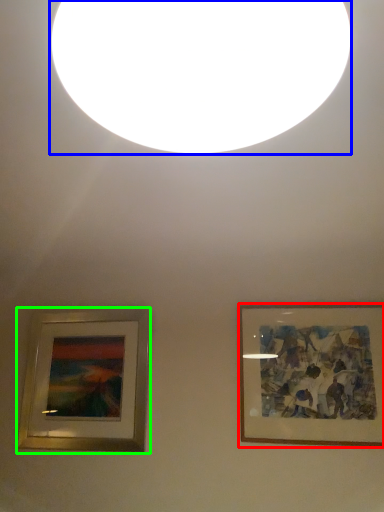
Question: Considering the real-world distances, which object is closest to picture frame (highlighted by a red box)? lighting (highlighted by a blue box) or picture frame (highlighted by a green box).

Choices:
 (A) lighting
 (B) picture frame

Answer: (B)